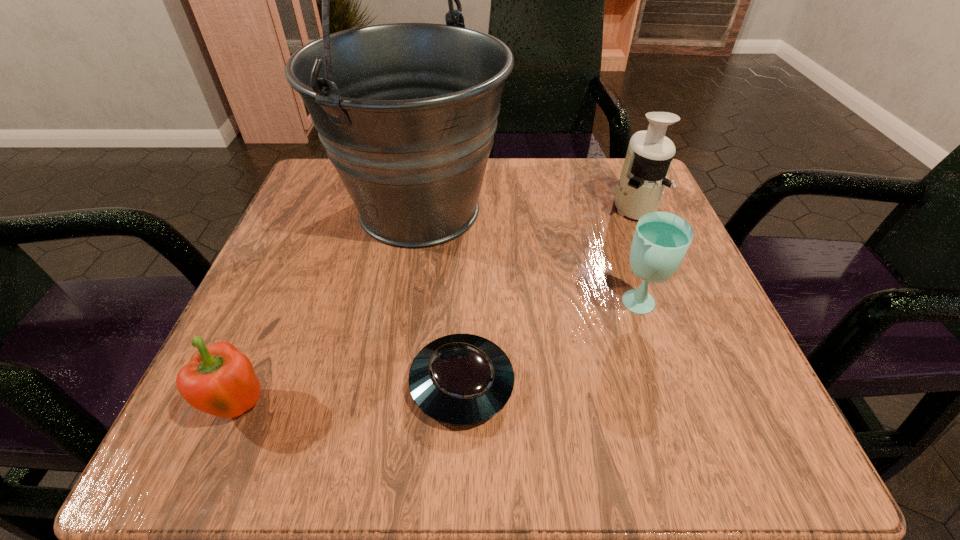
At what (x,y) coordinates should I click in order to perform the action: click on vacant area located on the left of the shortest object. Please return your answer as a coordinate pair (x, y). This screenshot has height=540, width=960. Looking at the image, I should click on (366, 384).

Identify the location of bucket that is at the far edge. (407, 112).

Locate an element on the screen. Image resolution: width=960 pixels, height=540 pixels. juicer at the far edge is located at coordinates (643, 178).

The image size is (960, 540). Identify the location of pepper at the near edge. (219, 380).

Locate an element on the screen. This screenshot has width=960, height=540. saucer situated at the near edge is located at coordinates (460, 379).

This screenshot has width=960, height=540. Find the location of `bucket present at the left edge`. bucket present at the left edge is located at coordinates (407, 112).

Where is `pepper at the left edge`? The height and width of the screenshot is (540, 960). pepper at the left edge is located at coordinates (219, 380).

Find the location of a particular element. This screenshot has width=960, height=540. juicer located at the right edge is located at coordinates (643, 178).

At what (x,y) coordinates should I click in order to perform the action: click on glass present at the right edge. Please return your answer as a coordinate pair (x, y). The width and height of the screenshot is (960, 540). Looking at the image, I should click on (661, 240).

This screenshot has width=960, height=540. Find the location of `object located at the far left corner`. object located at the far left corner is located at coordinates (407, 112).